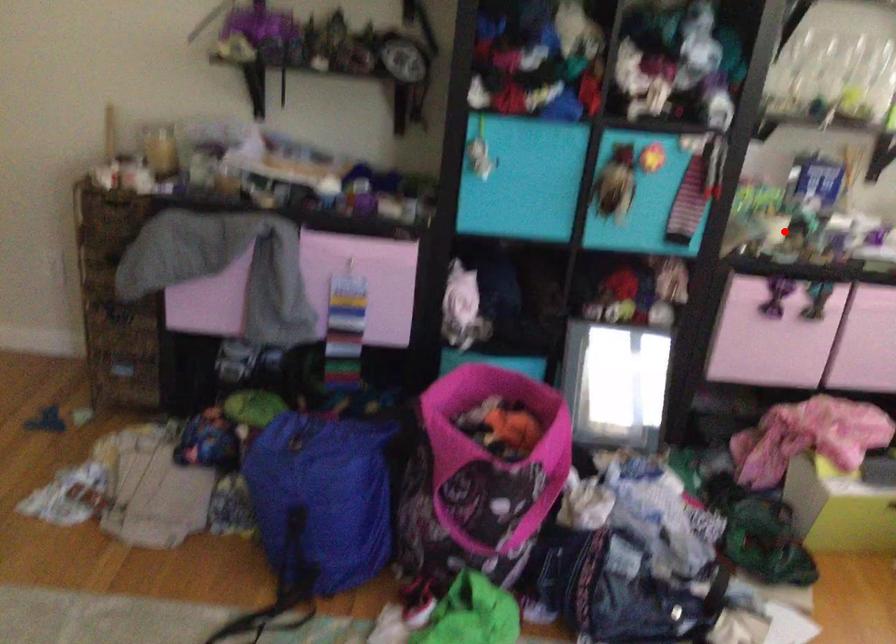
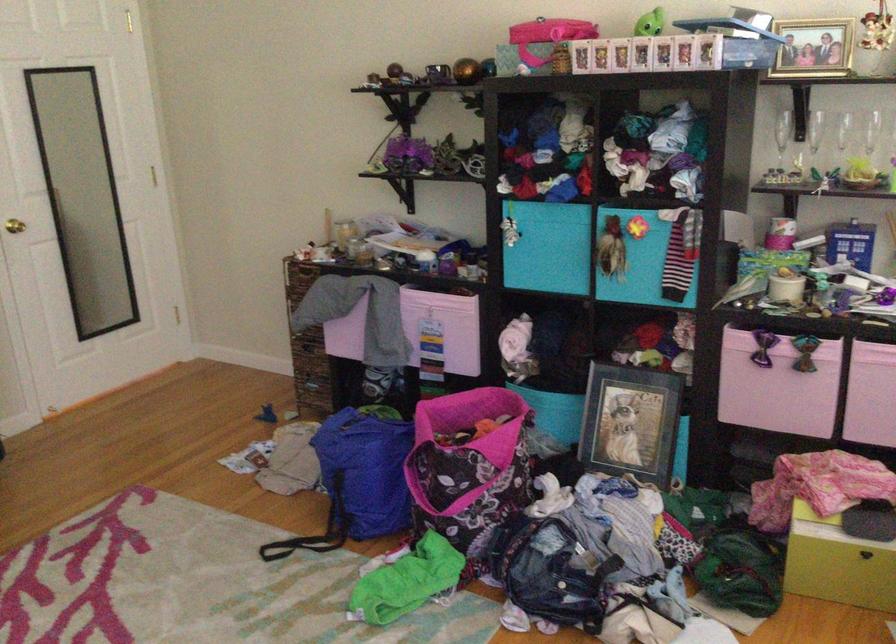
Locate, in the second image, the point that corresponds to the highlighted location in the first image.

(786, 289)